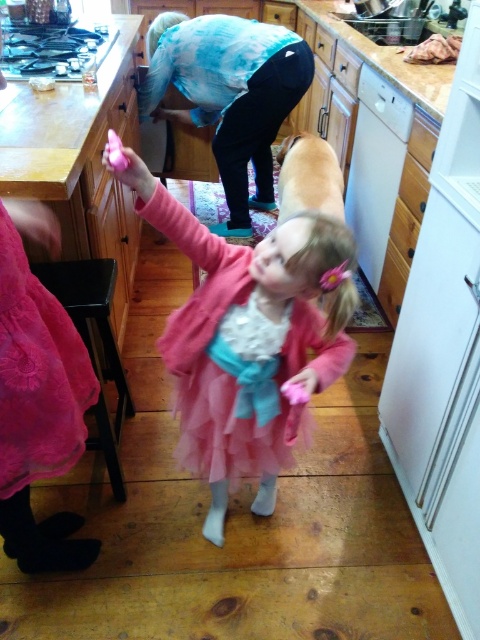
Is pink fluffy dress at center to the left of soft pink fur at center from the viewer's perspective?

Indeed, pink fluffy dress at center is positioned on the left side of soft pink fur at center.

Is pink fluffy dress at center thinner than soft pink fur at center?

Incorrect, pink fluffy dress at center's width is not less than soft pink fur at center's.

At what (x,y) coordinates should I click in order to perform the action: click on pink fluffy dress at center. Please return your answer as a coordinate pair (x, y). This screenshot has height=640, width=480. Looking at the image, I should click on (247, 337).

Who is taller, blue tie-dye shirt at upper center or velvet pink cushion at lower left?

blue tie-dye shirt at upper center

Who is shorter, blue tie-dye shirt at upper center or velvet pink cushion at lower left?

Standing shorter between the two is velvet pink cushion at lower left.

Who is more forward, (276, 42) or (99, 390)?

Positioned in front is point (99, 390).

Find the location of a particular element. This screenshot has width=480, height=640. blue tie-dye shirt at upper center is located at coordinates (228, 93).

How far apart are pink fluffy dress at center and velvet pink cushion at lower left?

pink fluffy dress at center and velvet pink cushion at lower left are 13.97 inches apart.

Does pink fluffy dress at center have a greater height compared to velvet pink cushion at lower left?

Yes.

This screenshot has width=480, height=640. Describe the element at coordinates (247, 337) in the screenshot. I see `pink fluffy dress at center` at that location.

This screenshot has width=480, height=640. Find the location of `pink fluffy dress at center`. pink fluffy dress at center is located at coordinates (247, 337).